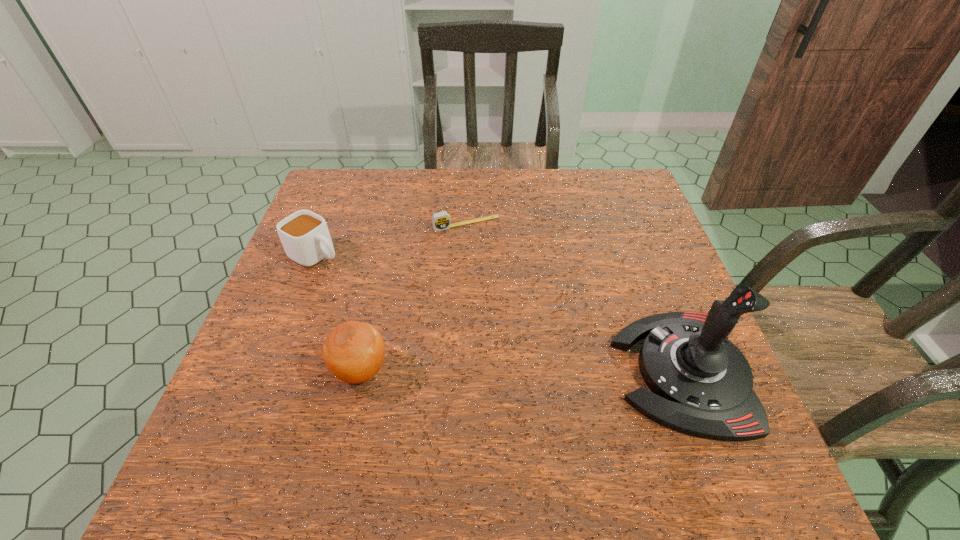
The height and width of the screenshot is (540, 960). Find the location of `the third closest object relative to the second object from left to right`. the third closest object relative to the second object from left to right is located at coordinates pos(701,383).

Where is `free space in the image that satisfies the following two spatial constraints: 1. on the back side of the orange; 2. on the right side of the farthest object`? This screenshot has height=540, width=960. free space in the image that satisfies the following two spatial constraints: 1. on the back side of the orange; 2. on the right side of the farthest object is located at coordinates (394, 224).

Identify the location of free region that satisfies the following two spatial constraints: 1. on the back side of the leftmost object; 2. on the right side of the shortest object. This screenshot has height=540, width=960. tap(328, 224).

The width and height of the screenshot is (960, 540). I want to click on blank space that satisfies the following two spatial constraints: 1. on the front side of the joystick; 2. on the handle side of the cup, so click(270, 372).

Where is `free point that satisfies the following two spatial constraints: 1. on the front side of the joystick; 2. on the handle side of the third tallest object`? free point that satisfies the following two spatial constraints: 1. on the front side of the joystick; 2. on the handle side of the third tallest object is located at coordinates (270, 372).

The image size is (960, 540). I want to click on free spot that satisfies the following two spatial constraints: 1. on the front side of the second tallest object; 2. on the right side of the cup, so pyautogui.click(x=271, y=370).

Locate an element on the screen. vacant space that satisfies the following two spatial constraints: 1. on the front side of the rightmost object; 2. on the handle side of the orange is located at coordinates (360, 372).